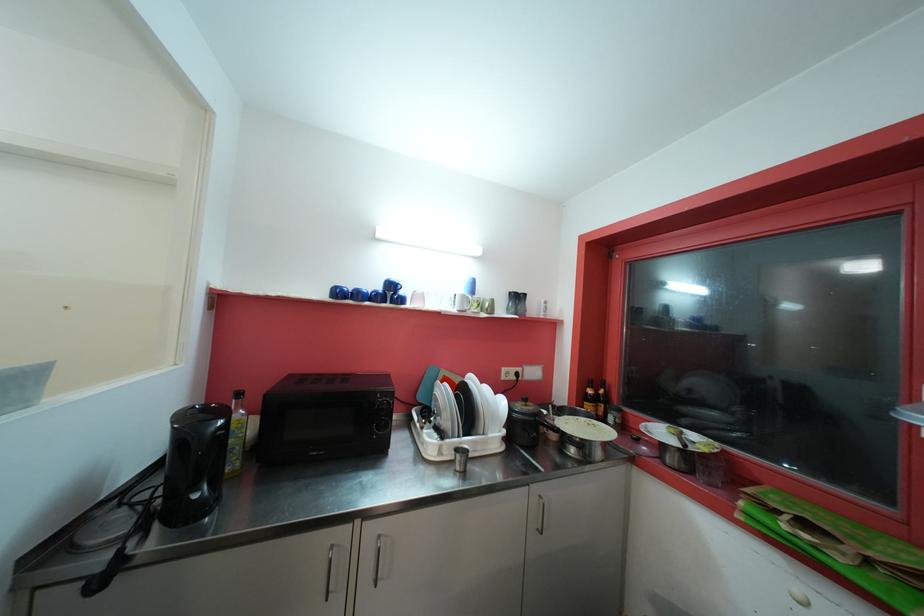
The width and height of the screenshot is (924, 616). Describe the element at coordinates (675, 455) in the screenshot. I see `the pan handle` at that location.